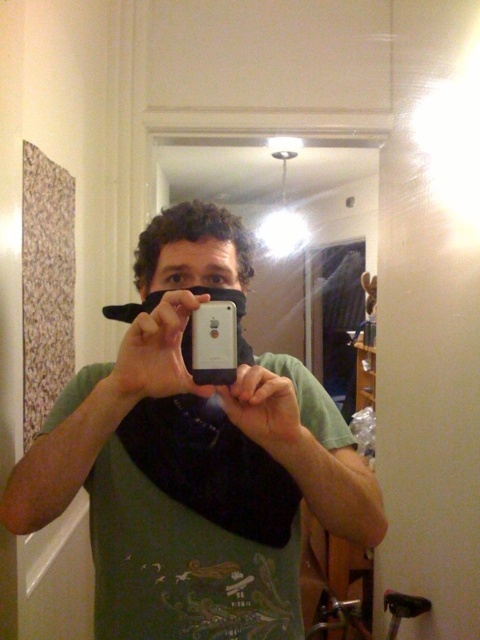
Does green matte shirt at center have a lesser width compared to white matte smartphone at center?

In fact, green matte shirt at center might be wider than white matte smartphone at center.

Which is behind, point (136, 476) or point (224, 381)?

Point (136, 476)

Locate an element on the screen. green matte shirt at center is located at coordinates (154, 483).

In order to click on green matte shirt at center in this screenshot , I will do `click(154, 483)`.